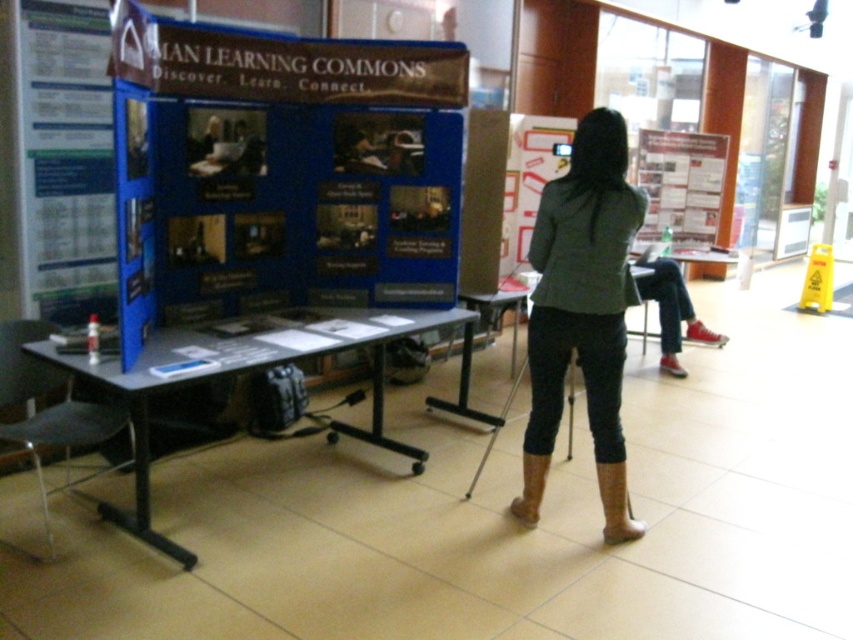
Between point (538, 260) and point (344, 428), which one is positioned behind?

Point (344, 428)

Is dark gray blazer at center thinner than metallic gray table at center?

Yes, dark gray blazer at center is thinner than metallic gray table at center.

Between point (643, 204) and point (177, 349), which one is positioned in front?

Point (643, 204) is more forward.

The width and height of the screenshot is (853, 640). Find the location of `dark gray blazer at center`. dark gray blazer at center is located at coordinates (582, 312).

Does metallic gray table at center have a lesser width compared to matte paper poster at upper right?

Incorrect, metallic gray table at center's width is not less than matte paper poster at upper right's.

You are a GUI agent. You are given a task and a screenshot of the screen. Output one action in this format:
    pyautogui.click(x=<x>, y=<y>)
    Task: Click on the metallic gray table at center
    Image resolution: width=853 pixels, height=640 pixels.
    Given the screenshot: What is the action you would take?
    pyautogui.click(x=256, y=369)

The image size is (853, 640). In order to click on metallic gray table at center in this screenshot , I will do (x=256, y=369).

Find the location of a particular element. Image resolution: width=853 pixels, height=640 pixels. metallic gray table at center is located at coordinates (256, 369).

Can you confirm if white paper poster at left is wider than matte paper poster at upper right?

In fact, white paper poster at left might be narrower than matte paper poster at upper right.

Which is in front, point (49, 310) or point (674, 136)?

Point (49, 310) is more forward.

Is point (25, 68) more distant than point (692, 154)?

That is False.

Where is `white paper poster at left`? This screenshot has width=853, height=640. white paper poster at left is located at coordinates (65, 157).